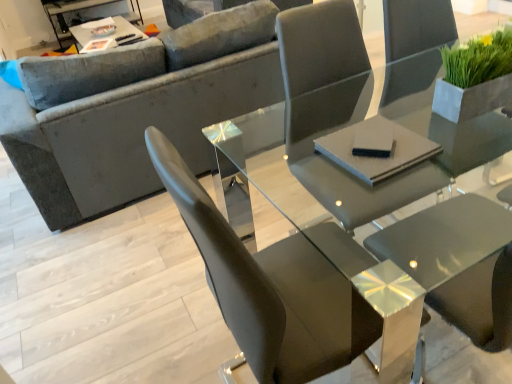
Measure the distance between matte gray chair at center and camera.

The distance of matte gray chair at center from camera is 1.40 meters.

The height and width of the screenshot is (384, 512). Identify the location of black matte pad at center, positioned as the 1th pad in left-to-right order. (373, 141).

You are a GUI agent. You are given a task and a screenshot of the screen. Output one action in this format:
    pyautogui.click(x=<x>, y=<y>)
    Task: Click on the velvet gray couch at upper left
    The width and height of the screenshot is (512, 384).
    Given the screenshot: What is the action you would take?
    pyautogui.click(x=142, y=118)

The height and width of the screenshot is (384, 512). What do you see at coordinates (475, 77) in the screenshot? I see `green matte plant at upper right` at bounding box center [475, 77].

Locate an element on the screen. matte gray chair at center is located at coordinates (337, 113).

Is matte gray chair at center looking in the opposite direction of black matte pad at center, positioned as the 1th pad in left-to-right order?

No.

Does matte gray chair at center appear on the right side of black matte pad at center, positioned as the 2th pad in right-to-left order?

Correct, you'll find matte gray chair at center to the right of black matte pad at center, positioned as the 2th pad in right-to-left order.

Which of these two, matte gray chair at center or black matte pad at center, positioned as the 2th pad in right-to-left order, stands shorter?

Standing shorter between the two is black matte pad at center, positioned as the 2th pad in right-to-left order.

Which object is closer to the camera, matte gray chair at center or black matte pad at center, positioned as the 1th pad in left-to-right order?

matte gray chair at center is closer to the camera.

Would you say glossy glass table at center, the 1th table in the right-to-left sequence, is outside velvet gray couch at upper left?

Yes, glossy glass table at center, the 1th table in the right-to-left sequence, is not within velvet gray couch at upper left.

Can you confirm if glossy glass table at center, placed as the 2th table when sorted from left to right, is taller than velvet gray couch at upper left?

Incorrect, the height of glossy glass table at center, placed as the 2th table when sorted from left to right, is not larger of that of velvet gray couch at upper left.

Considering the relative sizes of glossy glass table at center, which is the first table from front to back, and velvet gray couch at upper left in the image provided, is glossy glass table at center, which is the first table from front to back, wider than velvet gray couch at upper left?

No, glossy glass table at center, which is the first table from front to back, is not wider than velvet gray couch at upper left.

Considering the relative positions of matte gray chair at center and glossy glass table at center, the 2th table viewed from the back, in the image provided, is matte gray chair at center in front of glossy glass table at center, the 2th table viewed from the back,?

No, the depth of matte gray chair at center is greater than that of glossy glass table at center, the 2th table viewed from the back.

Does matte gray chair at center touch glossy glass table at center, the 2th table viewed from the back?

Yes, matte gray chair at center and glossy glass table at center, the 2th table viewed from the back, clearly make contact.

From a real-world perspective, which table is the 1st one underneath the matte gray chair at center? Please provide its 2D coordinates.

[(325, 207)]

Is matte gray chair at center oriented towards glossy glass table at center, arranged as the second table when viewed from the top?

Yes, matte gray chair at center is turned towards glossy glass table at center, arranged as the second table when viewed from the top.

Is glossy glass table at center, positioned as the first table in bottom-to-top order, to the left of black matte pad at center, positioned as the 2th pad in right-to-left order, from the viewer's perspective?

No.

Is glossy glass table at center, placed as the 2th table when sorted from left to right, turned away from black matte pad at center, positioned as the 2th pad in right-to-left order?

No, glossy glass table at center, placed as the 2th table when sorted from left to right,'s orientation is not away from black matte pad at center, positioned as the 2th pad in right-to-left order.

Considering the relative sizes of glossy glass table at center, which is the first table from front to back, and black matte pad at center, positioned as the 2th pad in right-to-left order, in the image provided, is glossy glass table at center, which is the first table from front to back, smaller than black matte pad at center, positioned as the 2th pad in right-to-left order,?

No.

From a real-world perspective, is matte gray chair at center positioned above or below green matte plant at upper right?

In terms of real-world spatial position, matte gray chair at center is below green matte plant at upper right.

Find the location of a particular element. houseplant that appears behind the matte gray chair at center is located at coordinates (475, 77).

Can you tell me how much glossy glass table at center, placed as the 2th table when sorted from left to right, and green matte plant at upper right differ in facing direction?

glossy glass table at center, placed as the 2th table when sorted from left to right, and green matte plant at upper right are facing 6.95 degrees away from each other.

Which is more to the right, glossy glass table at center, positioned as the first table in bottom-to-top order, or green matte plant at upper right?

glossy glass table at center, positioned as the first table in bottom-to-top order.

Is glossy glass table at center, the 2th table viewed from the back, bigger than green matte plant at upper right?

Yes, glossy glass table at center, the 2th table viewed from the back, is bigger than green matte plant at upper right.

Are glossy glass table at center, positioned as the first table in bottom-to-top order, and green matte plant at upper right beside each other?

They are not placed beside each other.

At what (x,y) coordinates should I click in order to perform the action: click on table lying in front of the gray matte pad at center, the first pad when ordered from right to left. Please return your answer as a coordinate pair (x, y). The width and height of the screenshot is (512, 384). Looking at the image, I should click on (325, 207).

Considering the relative sizes of glossy glass table at center, which is the first table from front to back, and gray matte pad at center, the first pad when ordered from right to left, in the image provided, is glossy glass table at center, which is the first table from front to back, thinner than gray matte pad at center, the first pad when ordered from right to left,?

Incorrect, the width of glossy glass table at center, which is the first table from front to back, is not less than that of gray matte pad at center, the first pad when ordered from right to left.

Is glossy glass table at center, arranged as the second table when viewed from the top, looking in the opposite direction of gray matte pad at center, the first pad when ordered from right to left?

No, glossy glass table at center, arranged as the second table when viewed from the top, is not facing away from gray matte pad at center, the first pad when ordered from right to left.

Where is `chair below the black matte pad at center, positioned as the 2th pad in right-to-left order (from a real-world perspective)`? The image size is (512, 384). chair below the black matte pad at center, positioned as the 2th pad in right-to-left order (from a real-world perspective) is located at coordinates (337, 113).

Identify the location of studio couch above the glossy glass table at center, positioned as the first table in bottom-to-top order (from a real-world perspective). (142, 118).

From the image, which object appears to be nearer to gray matte pad at center, the second pad from the left, glossy glass table at center, positioned as the first table in bottom-to-top order, or velvet gray couch at upper left?

Among the two, glossy glass table at center, positioned as the first table in bottom-to-top order, is located nearer to gray matte pad at center, the second pad from the left.

When comparing their distances from velvet gray couch at upper left, does metallic silver tray at upper left, the 1th table positioned from the back, or green matte plant at upper right seem further?

Based on the image, metallic silver tray at upper left, the 1th table positioned from the back, appears to be further to velvet gray couch at upper left.

Estimate the real-world distances between objects in this image. Which object is further from green matte plant at upper right, velvet gray couch at upper left or glossy glass table at center, placed as the 2th table when sorted from left to right?

velvet gray couch at upper left lies further to green matte plant at upper right than the other object.

Estimate the real-world distances between objects in this image. Which object is further from gray matte pad at center, the second pad from the left, velvet gray couch at upper left or black matte pad at center, positioned as the 1th pad in left-to-right order?

velvet gray couch at upper left is positioned further to the anchor gray matte pad at center, the second pad from the left.

Estimate the real-world distances between objects in this image. Which object is further from velvet gray couch at upper left, gray matte pad at center, the second pad from the left, or glossy glass table at center, the 1th table in the right-to-left sequence?

gray matte pad at center, the second pad from the left, is positioned further to the anchor velvet gray couch at upper left.

Which object lies further to the anchor point glossy glass table at center, the 2th table viewed from the back, matte gray chair at center or green matte plant at upper right?

green matte plant at upper right lies further to glossy glass table at center, the 2th table viewed from the back, than the other object.

From the image, which object appears to be farther from gray matte pad at center, the second pad from the left, green matte plant at upper right or matte gray chair at center?

Based on the image, matte gray chair at center appears to be further to gray matte pad at center, the second pad from the left.

From the image, which object appears to be farther from gray matte pad at center, the first pad when ordered from right to left, metallic silver tray at upper left, the 1th table positioned from the back, or green matte plant at upper right?

Based on the image, metallic silver tray at upper left, the 1th table positioned from the back, appears to be further to gray matte pad at center, the first pad when ordered from right to left.

You are a GUI agent. You are given a task and a screenshot of the screen. Output one action in this format:
    pyautogui.click(x=<x>, y=<y>)
    Task: Click on the chair between black matte pad at center, positioned as the 2th pad in right-to-left order, and green matte plant at upper right
    This screenshot has height=384, width=512.
    Given the screenshot: What is the action you would take?
    pyautogui.click(x=337, y=113)

The height and width of the screenshot is (384, 512). I want to click on chair between gray matte pad at center, the second pad from the left, and green matte plant at upper right, in the horizontal direction, so click(337, 113).

Where is `pad positioned between green matte plant at upper right and metallic silver tray at upper left, the 1th table positioned from the back, from near to far`? This screenshot has height=384, width=512. pad positioned between green matte plant at upper right and metallic silver tray at upper left, the 1th table positioned from the back, from near to far is located at coordinates (373, 141).

Identify the location of studio couch positioned between black matte pad at center, positioned as the 1th pad in left-to-right order, and metallic silver tray at upper left, placed as the 1th table when sorted from left to right, from near to far. Image resolution: width=512 pixels, height=384 pixels. (142, 118).